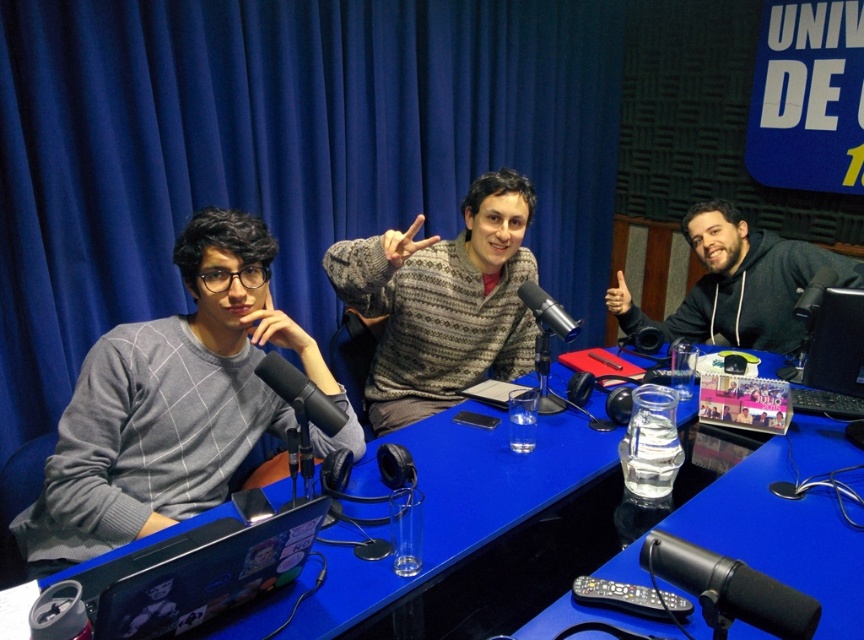
You are standing in the studio and want to place a small microphone stand exactly at point (183, 257). The stand requires a space of 1.5 meters from the camera to avoid blocking the view. Will placing it there be okay?

The distance of point (183, 257) from camera is 1.64 meters, so placing the microphone stand there will be okay since it is further than the required 1.5 meters.

You are a guest speaker in a radio studio. You need to place your notes on the table and adjust the microphone. Which object should you interact with first if you want to place your notes on the blue glossy table at center before adjusting the matte black microphone at center?

You should first place your notes on the blue glossy table at center because it is located below the matte black microphone at center, making it accessible first from the guest speaker position.

From the picture: You are a sound technician in a radio studio. You need to adjust the microphone stand so that the black matte microphone at right is closer to the knitted sweater at center. Which direction should you move the microphone stand?

You should move the microphone stand to the left so that the black matte microphone at right is closer to the knitted sweater at center.